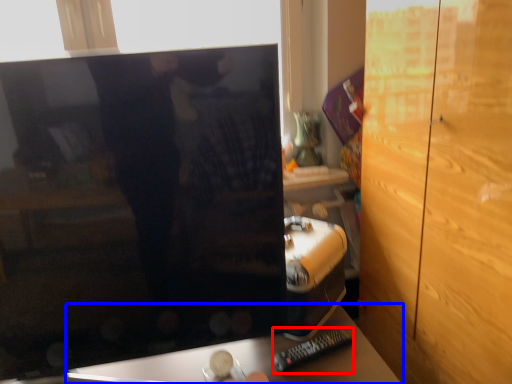
Question: Which object is closer to the camera taking this photo, remote (highlighted by a red box) or furniture (highlighted by a blue box)?

Choices:
 (A) remote
 (B) furniture

Answer: (B)